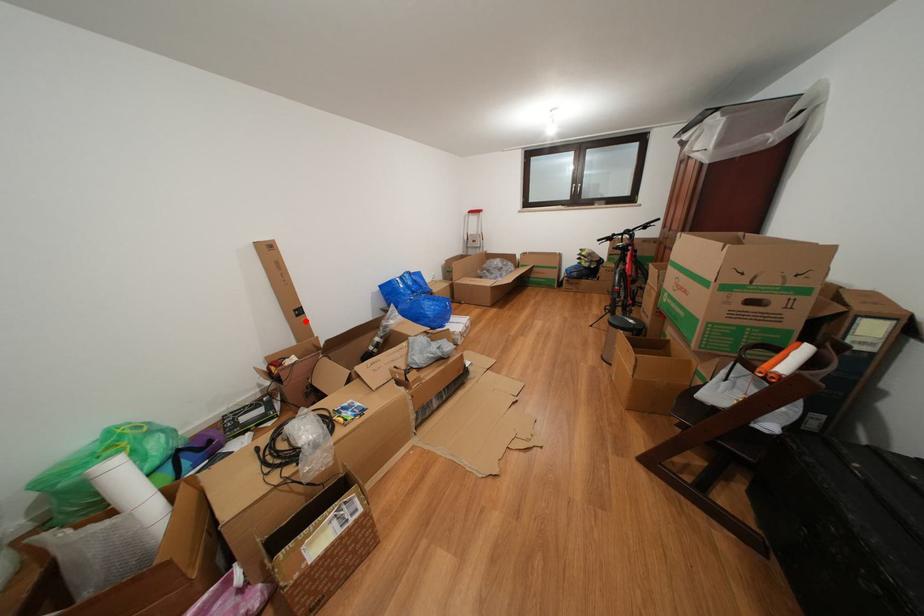
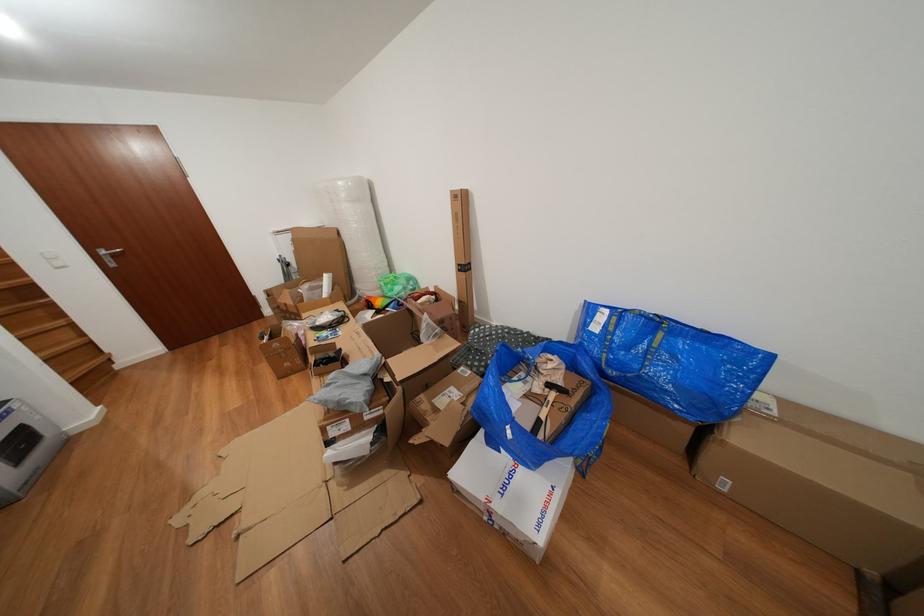
Question: I am providing you with two images of the same scene from different viewpoints. A red point is shown in image1. For the corresponding object point in image2, is it positioned nearer or farther from the camera?

Choices:
 (A) Nearer
 (B) Farther

Answer: (B)